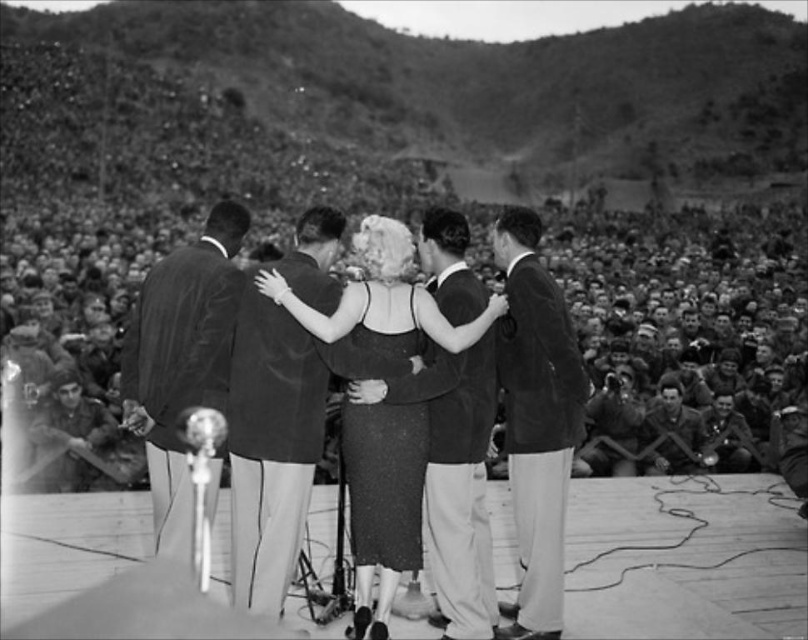
Measure the distance between point [160,380] and camera.

20.06 meters

In order to click on smooth black suit at center in this screenshot , I will do `click(181, 360)`.

Who is lower down, dark gray uniformed crowd at center or dark wool suit at center?

dark wool suit at center

Can you confirm if dark gray uniformed crowd at center is wider than dark wool suit at center?

Indeed, dark gray uniformed crowd at center has a greater width compared to dark wool suit at center.

The height and width of the screenshot is (640, 808). What do you see at coordinates (686, 314) in the screenshot?
I see `dark gray uniformed crowd at center` at bounding box center [686, 314].

Identify the location of dark gray uniformed crowd at center. (686, 314).

Can you confirm if shiny black dress at center is taller than smooth dark suit at center?

Yes, shiny black dress at center is taller than smooth dark suit at center.

Does shiny black dress at center have a greater width compared to smooth dark suit at center?

Indeed, shiny black dress at center has a greater width compared to smooth dark suit at center.

You are a GUI agent. You are given a task and a screenshot of the screen. Output one action in this format:
    pyautogui.click(x=<x>, y=<y>)
    Task: Click on the shiny black dress at center
    The image size is (808, 640).
    Given the screenshot: What is the action you would take?
    pyautogui.click(x=384, y=502)

Locate an element on the screen. This screenshot has width=808, height=640. shiny black dress at center is located at coordinates (384, 502).